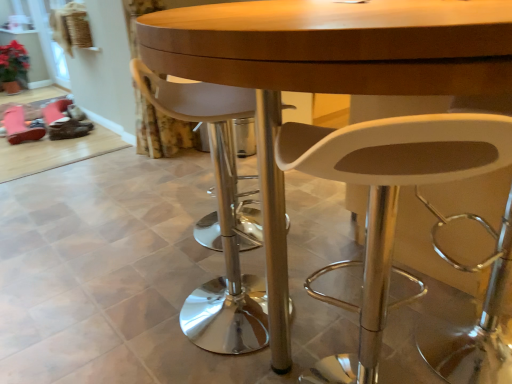
This screenshot has width=512, height=384. What are the coordinates of `free space to the left of white plastic stool at center, placed as the 1th chair when sorted from left to right` in the screenshot? It's located at (128, 316).